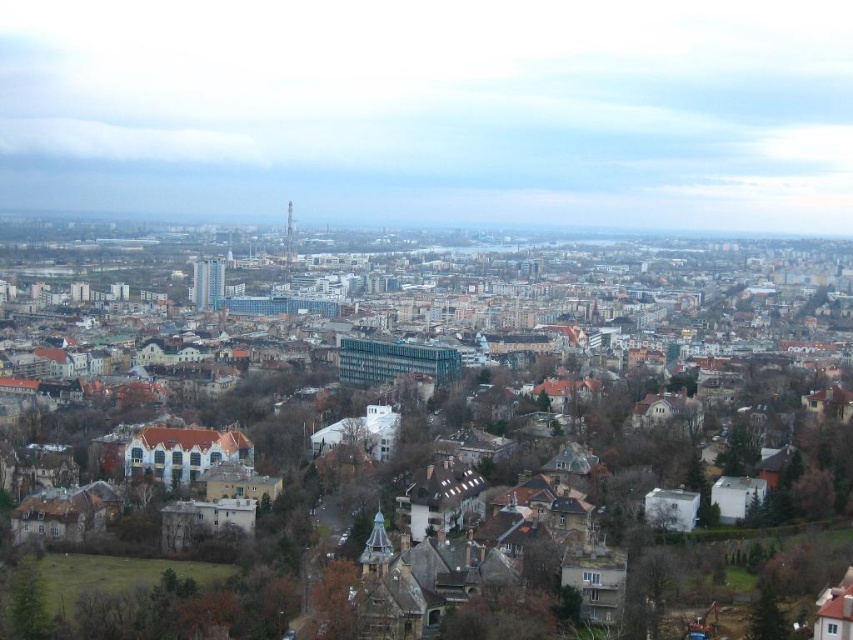
You are standing at the edge of a city park and see the brown stone buildings at center and the brown textured tree at lower center in your view. Which object appears closer to you based on their positions in the image?

The brown textured tree at lower center appears closer because it is positioned below the brown stone buildings at center, which is a common visual cue indicating depth in images.

Based on the photo, you are standing at the point marked by the coordinate point (474,464) in the cityscape image. Looking around, you see a brown stone building. Which direction should you face to see the brown stone buildings at center?

The point (474,464) represents the brown stone buildings at center, so you are already facing them.